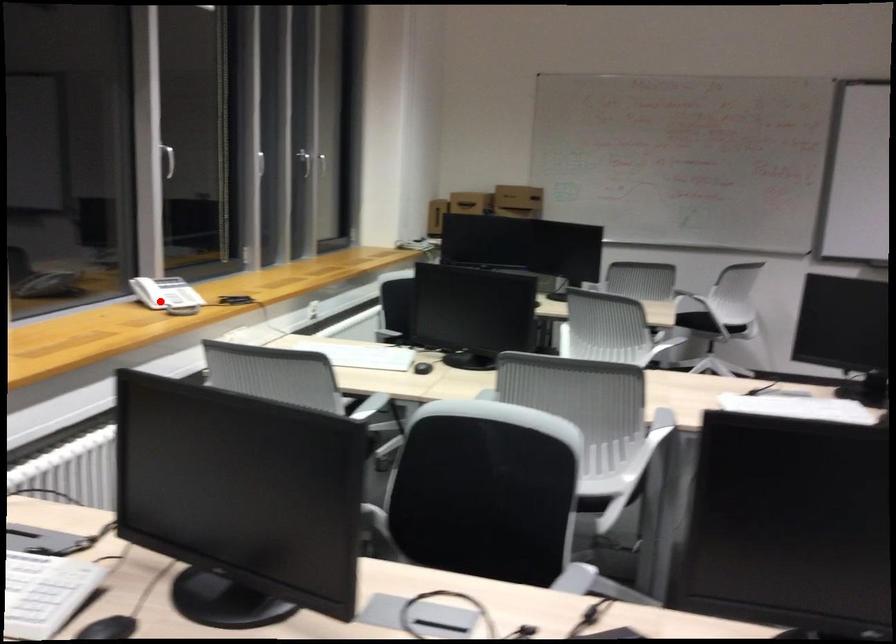
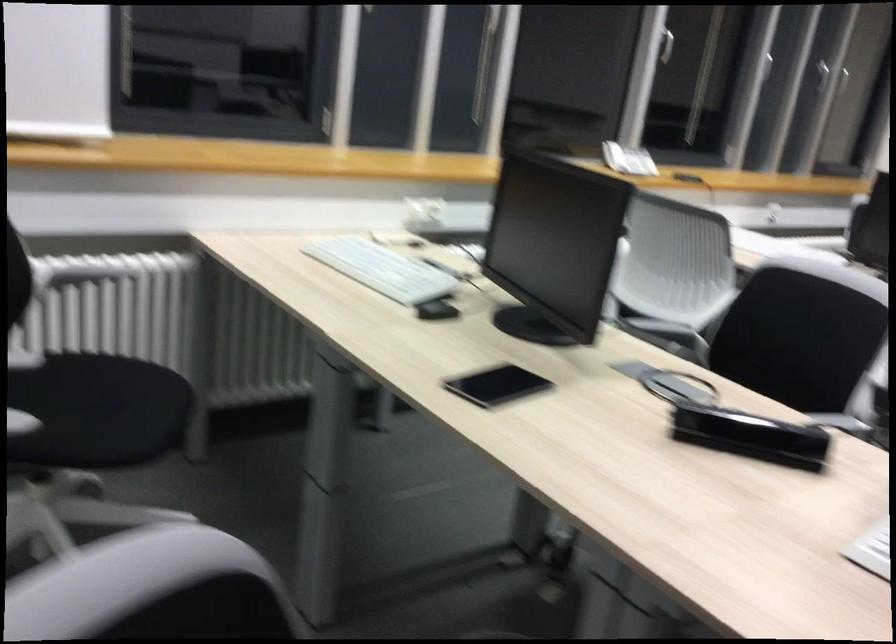
The point at the highlighted location is marked in the first image. Where is the corresponding point in the second image?

(614, 156)